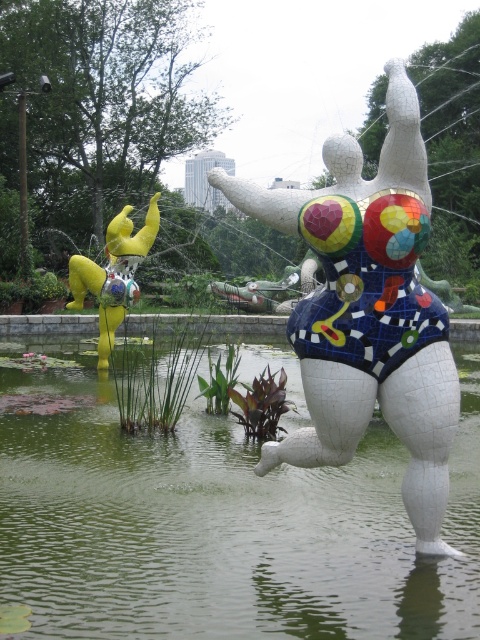
Question: Can you confirm if green liquid water at center is smaller than metallic yellow sculpture at left?

Choices:
 (A) no
 (B) yes

Answer: (B)

Question: Which point appears closest to the camera in this image?

Choices:
 (A) (0, 560)
 (B) (410, 404)

Answer: (B)

Question: Which of the following is the farthest from the observer?

Choices:
 (A) (130, 276)
 (B) (417, 632)
 (C) (321, 349)

Answer: (A)

Question: Which is nearer to the metallic yellow sculpture at left?

Choices:
 (A) cracked mosaic torso at center
 (B) green liquid water at center

Answer: (B)

Question: Can you confirm if green liquid water at center is positioned to the right of metallic yellow sculpture at left?

Choices:
 (A) yes
 (B) no

Answer: (A)

Question: Is green liquid water at center above cracked mosaic torso at center?

Choices:
 (A) yes
 (B) no

Answer: (B)